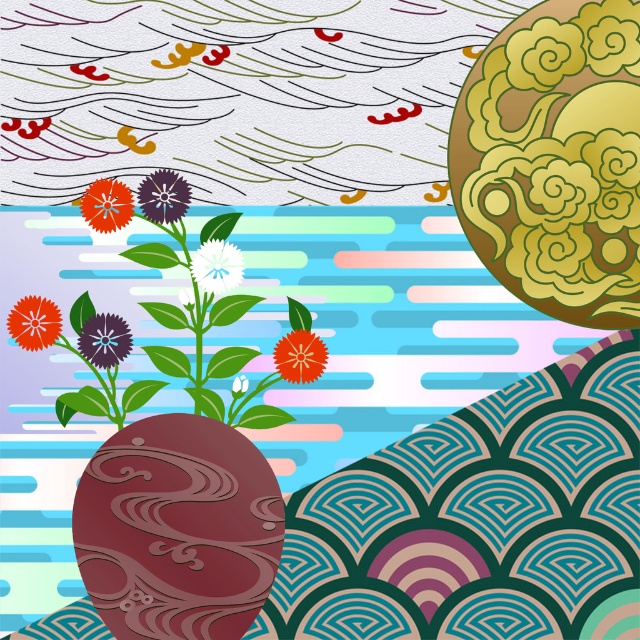
Does brown glossy stone at center have a smaller size compared to purple matte flower at center-left?

No.

Is point (147, 582) positioned before point (106, 339)?

Yes, it is in front of point (106, 339).

Where is `brown glossy stone at center`? This screenshot has width=640, height=640. brown glossy stone at center is located at coordinates (177, 529).

Can you confirm if matte ceramic vase at center is smaller than purple matte flower at center-left?

Actually, matte ceramic vase at center might be larger than purple matte flower at center-left.

Is point (205, 378) positioned after point (109, 314)?

Yes, it is.

Which is behind, point (220, 410) or point (97, 314)?

The point (97, 314) is behind.

Find the location of `matte ceramic vase at center`. matte ceramic vase at center is located at coordinates (193, 323).

Can you confirm if purple matte flower at center-left is positioned above purple matte flower at center?

Incorrect, purple matte flower at center-left is not positioned above purple matte flower at center.

Which is below, purple matte flower at center-left or purple matte flower at center?

Positioned lower is purple matte flower at center-left.

Does point (128, 326) come closer to viewer compared to point (145, 195)?

No, it is not.

Where is `purple matte flower at center-left`? purple matte flower at center-left is located at coordinates (104, 339).